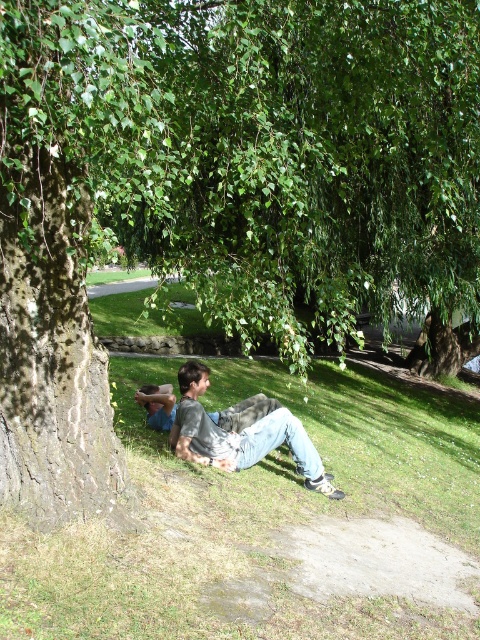
Question: Does green grass at lower center have a lesser width compared to gray cotton shirt at center?

Choices:
 (A) no
 (B) yes

Answer: (A)

Question: Can you confirm if green grass at lower center is positioned to the left of gray cotton shirt at center?

Choices:
 (A) no
 (B) yes

Answer: (A)

Question: Which of the following is the closest to the observer?

Choices:
 (A) green grass at lower center
 (B) gray cotton shirt at center

Answer: (A)

Question: Does green grass at lower center have a lesser width compared to gray cotton shirt at center?

Choices:
 (A) no
 (B) yes

Answer: (A)